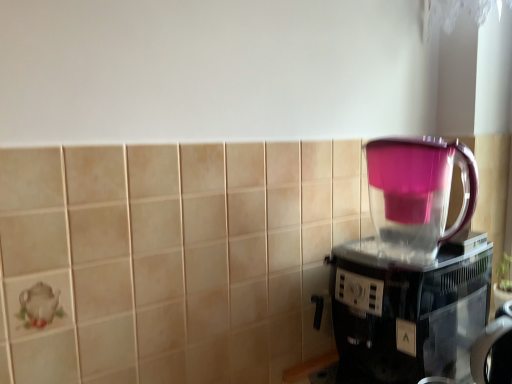
Question: In terms of width, does transparent plastic coffee maker at right look wider or thinner when compared to pink translucent pitcher at right?

Choices:
 (A) wide
 (B) thin

Answer: (A)

Question: From the image's perspective, relative to pink translucent pitcher at right, is transparent plastic coffee maker at right above or below?

Choices:
 (A) below
 (B) above

Answer: (A)

Question: Is point (389, 302) closer or farther from the camera than point (395, 144)?

Choices:
 (A) farther
 (B) closer

Answer: (B)

Question: From a real-world perspective, is pink translucent pitcher at right positioned above or below transparent plastic coffee maker at right?

Choices:
 (A) above
 (B) below

Answer: (A)

Question: Is pink translucent pitcher at right inside or outside of transparent plastic coffee maker at right?

Choices:
 (A) outside
 (B) inside

Answer: (A)

Question: Considering the positions of pink translucent pitcher at right and transparent plastic coffee maker at right in the image, is pink translucent pitcher at right wider or thinner than transparent plastic coffee maker at right?

Choices:
 (A) wide
 (B) thin

Answer: (B)

Question: Considering their positions, is pink translucent pitcher at right located in front of or behind transparent plastic coffee maker at right?

Choices:
 (A) front
 (B) behind

Answer: (B)